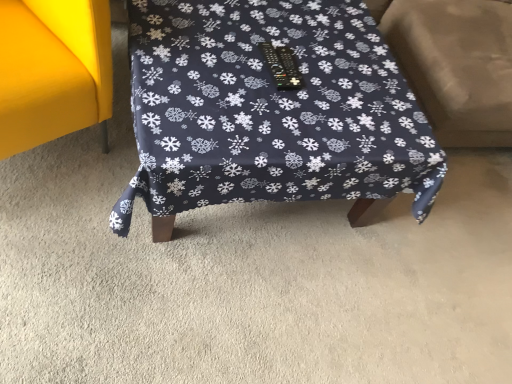
Question: Can you confirm if dark blue fabric table at center, the 1th furniture from the right, is positioned to the left of matte yellow sofa at left, which appears as the 2th furniture when viewed from the right?

Choices:
 (A) no
 (B) yes

Answer: (A)

Question: Considering the relative sizes of dark blue fabric table at center, which is the second furniture from left to right, and matte yellow sofa at left, acting as the 1th furniture starting from the left, in the image provided, is dark blue fabric table at center, which is the second furniture from left to right, wider than matte yellow sofa at left, acting as the 1th furniture starting from the left,?

Choices:
 (A) no
 (B) yes

Answer: (B)

Question: From the image's perspective, is dark blue fabric table at center, the 1th furniture from the right, located above matte yellow sofa at left, which appears as the 2th furniture when viewed from the right?

Choices:
 (A) no
 (B) yes

Answer: (A)

Question: Does dark blue fabric table at center, the 1th furniture from the right, have a greater height compared to matte yellow sofa at left, acting as the 1th furniture starting from the left?

Choices:
 (A) no
 (B) yes

Answer: (A)

Question: Considering the relative sizes of dark blue fabric table at center, which is the second furniture from left to right, and matte yellow sofa at left, which appears as the 2th furniture when viewed from the right, in the image provided, is dark blue fabric table at center, which is the second furniture from left to right, shorter than matte yellow sofa at left, which appears as the 2th furniture when viewed from the right,?

Choices:
 (A) yes
 (B) no

Answer: (A)

Question: From the image's perspective, is matte yellow sofa at left, acting as the 1th furniture starting from the left, positioned above or below dark blue fabric table at center, the 1th furniture from the right?

Choices:
 (A) above
 (B) below

Answer: (A)

Question: Based on their sizes in the image, would you say matte yellow sofa at left, which appears as the 2th furniture when viewed from the right, is bigger or smaller than dark blue fabric table at center, the 1th furniture from the right?

Choices:
 (A) small
 (B) big

Answer: (A)

Question: Would you say matte yellow sofa at left, acting as the 1th furniture starting from the left, is inside or outside dark blue fabric table at center, which is the second furniture from left to right?

Choices:
 (A) inside
 (B) outside

Answer: (B)

Question: Considering the relative positions of matte yellow sofa at left, acting as the 1th furniture starting from the left, and dark blue fabric table at center, which is the second furniture from left to right, in the image provided, is matte yellow sofa at left, acting as the 1th furniture starting from the left, to the left or to the right of dark blue fabric table at center, which is the second furniture from left to right,?

Choices:
 (A) left
 (B) right

Answer: (A)

Question: From a real-world perspective, is beige fabric swivel chair at right positioned above or below dark blue fabric table at center, the 1th furniture from the right?

Choices:
 (A) below
 (B) above

Answer: (B)

Question: Is beige fabric swivel chair at right wider or thinner than dark blue fabric table at center, the 1th furniture from the right?

Choices:
 (A) wide
 (B) thin

Answer: (B)

Question: Is beige fabric swivel chair at right inside or outside of dark blue fabric table at center, the 1th furniture from the right?

Choices:
 (A) outside
 (B) inside

Answer: (A)

Question: Considering the positions of point (490, 39) and point (326, 125), is point (490, 39) closer or farther from the camera than point (326, 125)?

Choices:
 (A) farther
 (B) closer

Answer: (A)

Question: Looking at the image, does matte yellow sofa at left, which appears as the 2th furniture when viewed from the right, seem bigger or smaller compared to beige fabric swivel chair at right?

Choices:
 (A) small
 (B) big

Answer: (A)

Question: In the image, is matte yellow sofa at left, which appears as the 2th furniture when viewed from the right, on the left side or the right side of beige fabric swivel chair at right?

Choices:
 (A) left
 (B) right

Answer: (A)